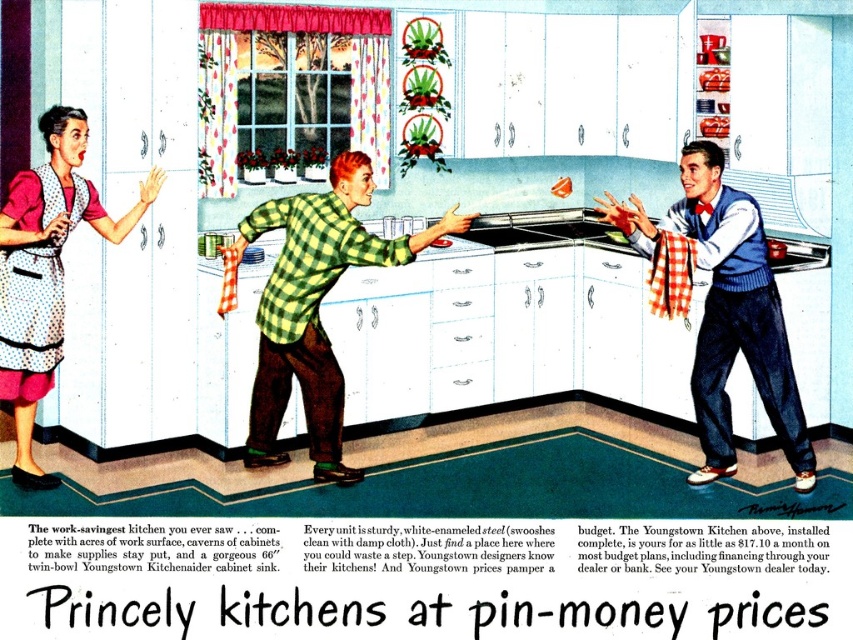
Is polka dot apron at left closer to the viewer compared to white dotted fabric apron at left?

Yes, it is.

Can you confirm if polka dot apron at left is wider than white dotted fabric apron at left?

Correct, the width of polka dot apron at left exceeds that of white dotted fabric apron at left.

Is point (50, 248) closer to camera compared to point (27, 333)?

That is False.

Where is `polka dot apron at left`? polka dot apron at left is located at coordinates (45, 269).

Measure the distance between green plaid shirt at center and camera.

4.21 meters

Between point (329, 385) and point (724, 369), which one is positioned behind?

The point (724, 369) is more distant.

Describe the element at coordinates (315, 307) in the screenshot. Image resolution: width=853 pixels, height=640 pixels. I see `green plaid shirt at center` at that location.

You are a GUI agent. You are given a task and a screenshot of the screen. Output one action in this format:
    pyautogui.click(x=<x>, y=<y>)
    Task: Click on the green plaid shirt at center
    The image size is (853, 640).
    Given the screenshot: What is the action you would take?
    (315, 307)

Is blue sweater at center wider than polka dot apron at left?

Indeed, blue sweater at center has a greater width compared to polka dot apron at left.

Does blue sweater at center appear on the left side of polka dot apron at left?

Incorrect, blue sweater at center is not on the left side of polka dot apron at left.

Find the location of a particular element. blue sweater at center is located at coordinates (727, 308).

Locate an element on the screen. blue sweater at center is located at coordinates (727, 308).